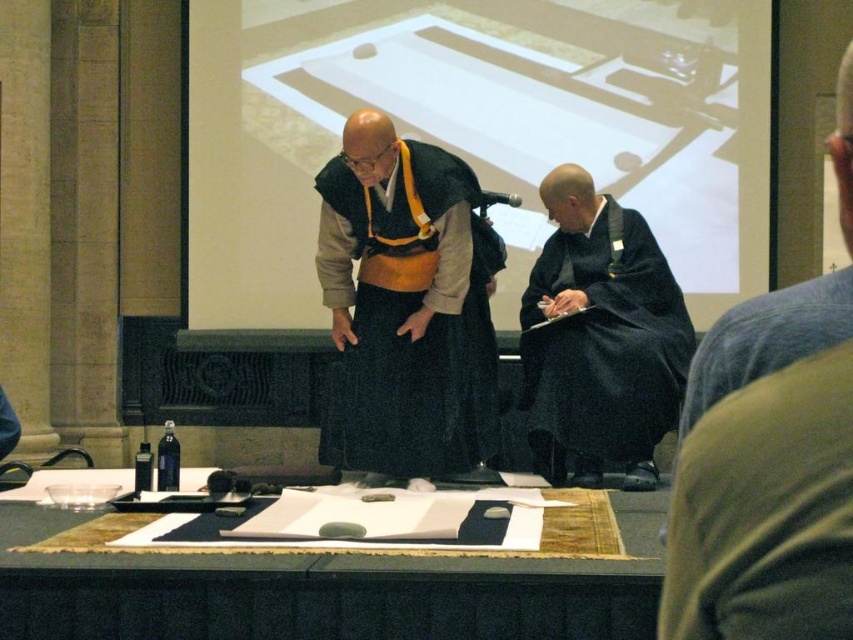
Question: Which point is closer to the camera taking this photo?

Choices:
 (A) (339, 435)
 (B) (399, 560)

Answer: (B)

Question: Can you confirm if smooth wooden table at center is smaller than black silk robe at center?

Choices:
 (A) no
 (B) yes

Answer: (B)

Question: Which object is positioned closest to the black silk robe at center?

Choices:
 (A) dark gray fabric robe at lower right
 (B) dark blue silk robe at lower right

Answer: (B)

Question: Is the position of smooth wooden table at center more distant than that of dark gray fabric robe at lower right?

Choices:
 (A) no
 (B) yes

Answer: (B)

Question: Among these points, which one is nearest to the camera?

Choices:
 (A) (840, 269)
 (B) (436, 403)
 (C) (62, 598)
 (D) (840, 275)

Answer: (D)

Question: Is smooth wooden table at center further to the viewer compared to dark blue silk robe at lower right?

Choices:
 (A) no
 (B) yes

Answer: (B)